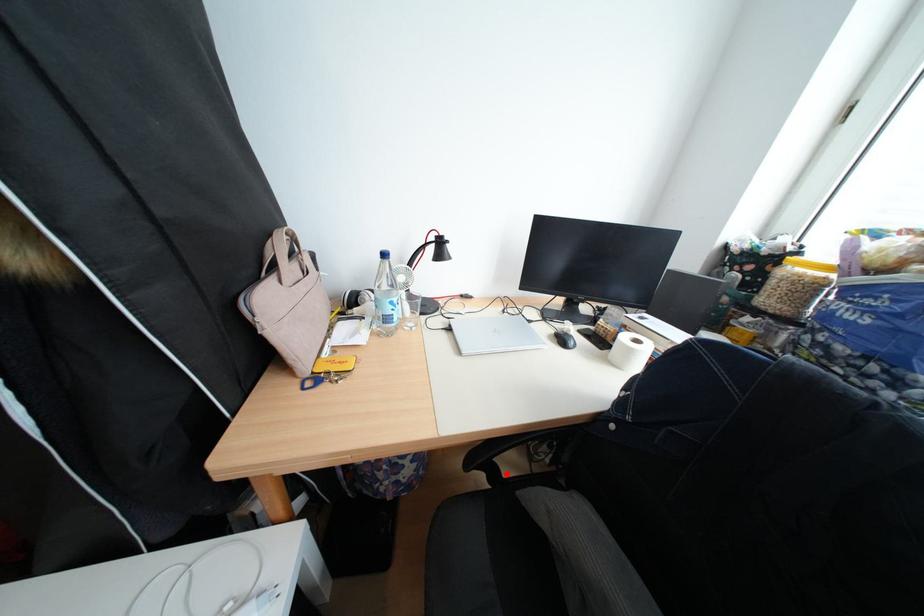
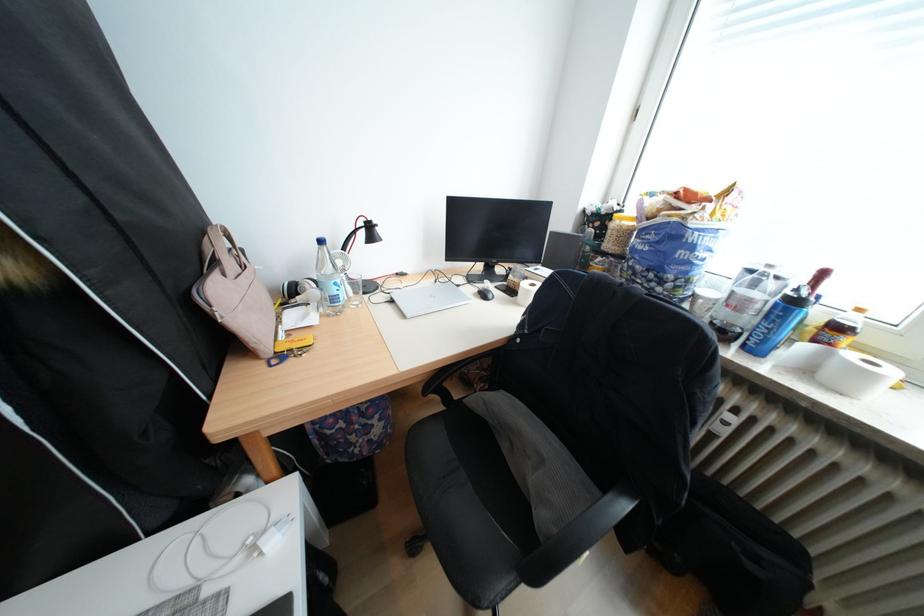
Question: I am providing you with two images of the same scene from different viewpoints. Given a red point in image1, look at the same physical point in image2. Is it:

Choices:
 (A) Closer to the viewpoint
 (B) Farther from the viewpoint

Answer: (A)